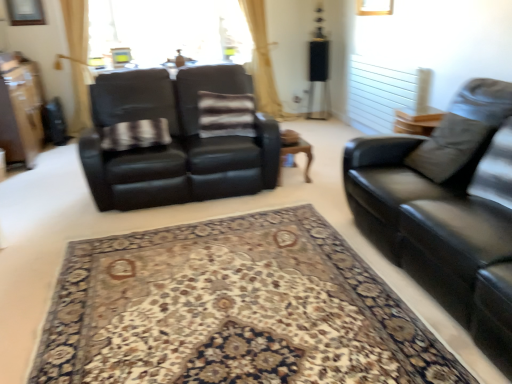
Describe the element at coordinates (20, 110) in the screenshot. I see `matte brown dresser at left` at that location.

Where is `matte brown dresser at left`? This screenshot has width=512, height=384. matte brown dresser at left is located at coordinates (20, 110).

This screenshot has width=512, height=384. What are the coordinates of `wooden coffee table at center` in the screenshot? It's located at (294, 154).

I want to click on carpeted rug at center, so 233,310.

What do you see at coordinates (169, 30) in the screenshot?
I see `transparent glass window screen at upper center` at bounding box center [169, 30].

In order to click on black leather couch at left, which is counted as the 1th studio couch, starting from the back in this screenshot , I will do `click(174, 142)`.

Locate an element on the screen. This screenshot has height=384, width=512. plaid fabric at center is located at coordinates (136, 134).

This screenshot has width=512, height=384. I want to click on matte brown dresser at left, so click(x=20, y=110).

Are matte brown dresser at left and carpeted rug at center beside each other?

No, matte brown dresser at left is not beside carpeted rug at center.

Which is more to the right, matte brown dresser at left or carpeted rug at center?

carpeted rug at center.

In the scene shown: Is matte brown dresser at left closer to camera compared to carpeted rug at center?

No, matte brown dresser at left is further to the viewer.

Locate an element on the screen. dresser that is above the carpeted rug at center (from the image's perspective) is located at coordinates (20, 110).

Considering the sizes of objects carpeted rug at center and black leather couch at right, placed as the 1th studio couch when sorted from front to back, in the image provided, who is taller, carpeted rug at center or black leather couch at right, placed as the 1th studio couch when sorted from front to back,?

With more height is black leather couch at right, placed as the 1th studio couch when sorted from front to back.

Is point (108, 277) positioned in front of point (496, 209)?

No.

Choose the correct answer: Is carpeted rug at center inside black leather couch at right, the 1th studio couch positioned from the right, or outside it?

carpeted rug at center is outside black leather couch at right, the 1th studio couch positioned from the right.

From the image's perspective, who appears lower, carpeted rug at center or black leather couch at right, positioned as the second studio couch in back-to-front order?

carpeted rug at center, from the image's perspective.

Considering the sizes of objects striped fabric pillow at center and matte brown dresser at left in the image provided, who is wider, striped fabric pillow at center or matte brown dresser at left?

With larger width is matte brown dresser at left.

Can you confirm if striped fabric pillow at center is positioned to the right of matte brown dresser at left?

Indeed, striped fabric pillow at center is positioned on the right side of matte brown dresser at left.

Who is more distant, striped fabric pillow at center or matte brown dresser at left?

matte brown dresser at left is more distant.

Is matte brown dresser at left located within striped fabric pillow at center?

No, matte brown dresser at left is not a part of striped fabric pillow at center.

From the image's perspective, who appears lower, striped fabric pillow at center or carpeted rug at center?

From the image's view, carpeted rug at center is below.

Could you tell me if striped fabric pillow at center is turned towards carpeted rug at center?

Yes, striped fabric pillow at center faces towards carpeted rug at center.

Which object is further away from the camera, striped fabric pillow at center or carpeted rug at center?

striped fabric pillow at center.

Is carpeted rug at center a part of striped fabric pillow at center?

Actually, carpeted rug at center is outside striped fabric pillow at center.

In the image, is transparent glass window screen at upper center on the left side or the right side of wooden coffee table at center?

transparent glass window screen at upper center is positioned on wooden coffee table at center's left side.

Are transparent glass window screen at upper center and wooden coffee table at center located far from each other?

That's right, there is a large distance between transparent glass window screen at upper center and wooden coffee table at center.

Is transparent glass window screen at upper center oriented away from wooden coffee table at center?

No, wooden coffee table at center is not at the back of transparent glass window screen at upper center.

From a real-world perspective, who is located higher, transparent glass window screen at upper center or wooden coffee table at center?

transparent glass window screen at upper center is physically above.

From the image's perspective, is black leather couch at right, placed as the 1th studio couch when sorted from front to back, located above striped fabric pillow at center?

Incorrect, from the image's perspective, black leather couch at right, placed as the 1th studio couch when sorted from front to back, is lower than striped fabric pillow at center.

Is black leather couch at right, placed as the 1th studio couch when sorted from front to back, spatially inside striped fabric pillow at center, or outside of it?

black leather couch at right, placed as the 1th studio couch when sorted from front to back, lies outside striped fabric pillow at center.

Can you confirm if black leather couch at right, positioned as the second studio couch in back-to-front order, is wider than striped fabric pillow at center?

Yes.

Can you confirm if black leather couch at right, placed as the 1th studio couch when sorted from front to back, is positioned to the right of striped fabric pillow at center?

Indeed, black leather couch at right, placed as the 1th studio couch when sorted from front to back, is positioned on the right side of striped fabric pillow at center.

Considering the relative sizes of black leather couch at right, the 1th studio couch positioned from the right, and black leather couch at left, which is counted as the 1th studio couch, starting from the back, in the image provided, is black leather couch at right, the 1th studio couch positioned from the right, smaller than black leather couch at left, which is counted as the 1th studio couch, starting from the back,?

No, black leather couch at right, the 1th studio couch positioned from the right, is not smaller than black leather couch at left, which is counted as the 1th studio couch, starting from the back.

Is black leather couch at right, which is counted as the 2th studio couch, starting from the left, in front of or behind black leather couch at left, acting as the second studio couch starting from the front, in the image?

black leather couch at right, which is counted as the 2th studio couch, starting from the left, is positioned closer to the viewer than black leather couch at left, acting as the second studio couch starting from the front.

From a real-world perspective, is black leather couch at right, positioned as the second studio couch in back-to-front order, located beneath black leather couch at left, which appears as the first studio couch when viewed from the left?

No, from a real-world perspective, black leather couch at right, positioned as the second studio couch in back-to-front order, is not under black leather couch at left, which appears as the first studio couch when viewed from the left.

Identify the location of mat that is below the matte brown dresser at left (from the image's perspective). (233, 310).

This screenshot has height=384, width=512. What are the coordinates of `mat behind the black leather couch at right, placed as the 1th studio couch when sorted from front to back` in the screenshot? It's located at (233, 310).

Considering their positions, is plaid fabric at center positioned closer to carpeted rug at center than black leather couch at left, the second studio couch from the right?

The object closer to carpeted rug at center is black leather couch at left, the second studio couch from the right.

Looking at the image, which one is located further to transparent glass window screen at upper center, black leather couch at right, which is counted as the 2th studio couch, starting from the left, or wooden coffee table at center?

The object further to transparent glass window screen at upper center is black leather couch at right, which is counted as the 2th studio couch, starting from the left.

Estimate the real-world distances between objects in this image. Which object is further from black leather couch at right, positioned as the second studio couch in back-to-front order, plaid fabric at center or transparent glass window screen at upper center?

Among the two, transparent glass window screen at upper center is located further to black leather couch at right, positioned as the second studio couch in back-to-front order.

In the scene shown: Which object lies further to the anchor point plaid fabric at center, black leather couch at right, placed as the 1th studio couch when sorted from front to back, or black leather couch at left, which is counted as the 1th studio couch, starting from the back?

black leather couch at right, placed as the 1th studio couch when sorted from front to back, is positioned further to the anchor plaid fabric at center.

Looking at the image, which one is located closer to black leather couch at left, which appears as the first studio couch when viewed from the left, transparent glass window screen at upper center or plaid fabric at center?

The object closer to black leather couch at left, which appears as the first studio couch when viewed from the left, is plaid fabric at center.

Looking at this image, based on their spatial positions, is plaid fabric at center or striped fabric pillow at center further from carpeted rug at center?

striped fabric pillow at center is positioned further to the anchor carpeted rug at center.

From the image, which object appears to be farther from wooden coffee table at center, black leather couch at right, positioned as the second studio couch in back-to-front order, or black leather couch at left, acting as the second studio couch starting from the front?

The object further to wooden coffee table at center is black leather couch at right, positioned as the second studio couch in back-to-front order.

From the image, which object appears to be nearer to carpeted rug at center, black leather couch at right, positioned as the second studio couch in back-to-front order, or plaid fabric at center?

Among the two, black leather couch at right, positioned as the second studio couch in back-to-front order, is located nearer to carpeted rug at center.

Locate an element on the screen. The width and height of the screenshot is (512, 384). blanket situated between matte brown dresser at left and black leather couch at right, which is counted as the 2th studio couch, starting from the left, from left to right is located at coordinates (136, 134).

In order to click on dresser located between carpeted rug at center and transparent glass window screen at upper center in the depth direction in this screenshot , I will do `click(20, 110)`.

This screenshot has width=512, height=384. Find the location of `studio couch between black leather couch at right, positioned as the second studio couch in back-to-front order, and transparent glass window screen at upper center in the front-back direction`. studio couch between black leather couch at right, positioned as the second studio couch in back-to-front order, and transparent glass window screen at upper center in the front-back direction is located at coordinates (174, 142).

You are a GUI agent. You are given a task and a screenshot of the screen. Output one action in this format:
    pyautogui.click(x=<x>, y=<y>)
    Task: Click on the pillow located between plaid fabric at center and transparent glass window screen at upper center in the depth direction
    This screenshot has width=512, height=384.
    Given the screenshot: What is the action you would take?
    pyautogui.click(x=226, y=114)